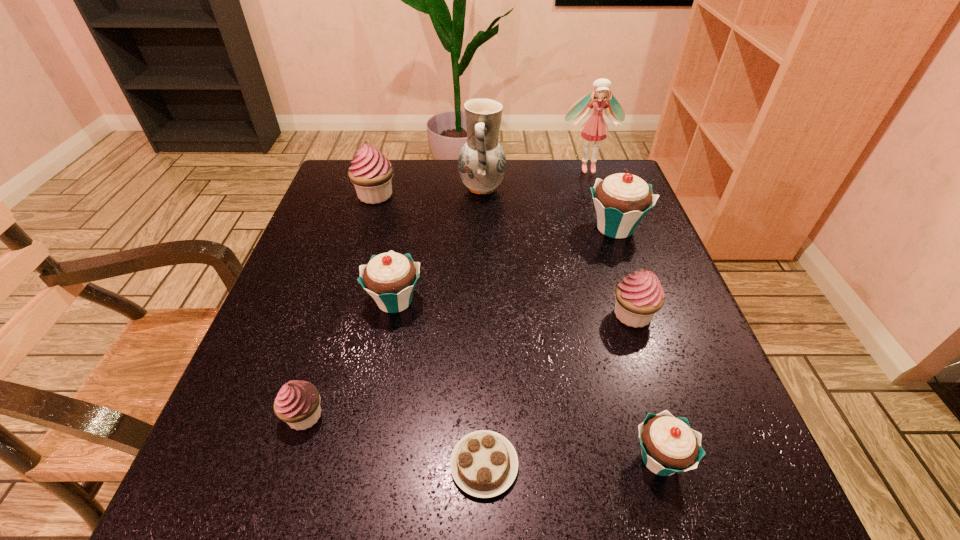
Identify the location of free point between the nearest pink cupcake and the leftmost teal cupcake. This screenshot has width=960, height=540. (349, 358).

The image size is (960, 540). What are the coordinates of `unoccupied position between the rightmost pink cupcake and the smallest pink cupcake` in the screenshot? It's located at (468, 365).

In order to click on vacant region between the biggest teal cupcake and the second smallest pink cupcake in this screenshot , I will do `click(624, 271)`.

Identify the location of free point between the leftmost teal cupcake and the pottery. (439, 245).

Locate an element on the screen. vacant point located between the shortest object and the pottery is located at coordinates (483, 327).

You are a GUI agent. You are given a task and a screenshot of the screen. Output one action in this format:
    pyautogui.click(x=<x>, y=<y>)
    Task: Click on the unoccupied area between the pottery and the biggest pink cupcake
    The image size is (960, 540).
    Given the screenshot: What is the action you would take?
    pyautogui.click(x=429, y=192)

The height and width of the screenshot is (540, 960). I want to click on the second closest object to the nearest teal cupcake, so click(640, 295).

Identify which object is the second nearest to the rightmost pink cupcake. Please provide its 2D coordinates. Your answer should be formatted as a tuple, i.e. [(x, y)], where the tuple contains the x and y coordinates of a point satisfying the conditions above.

[(669, 445)]

What are the coordinates of `the fifth closest cupcake to the second farthest teal cupcake` in the screenshot? It's located at (669, 445).

The width and height of the screenshot is (960, 540). I want to click on cupcake that can be found as the fifth closest to the sixth nearest object, so click(x=297, y=403).